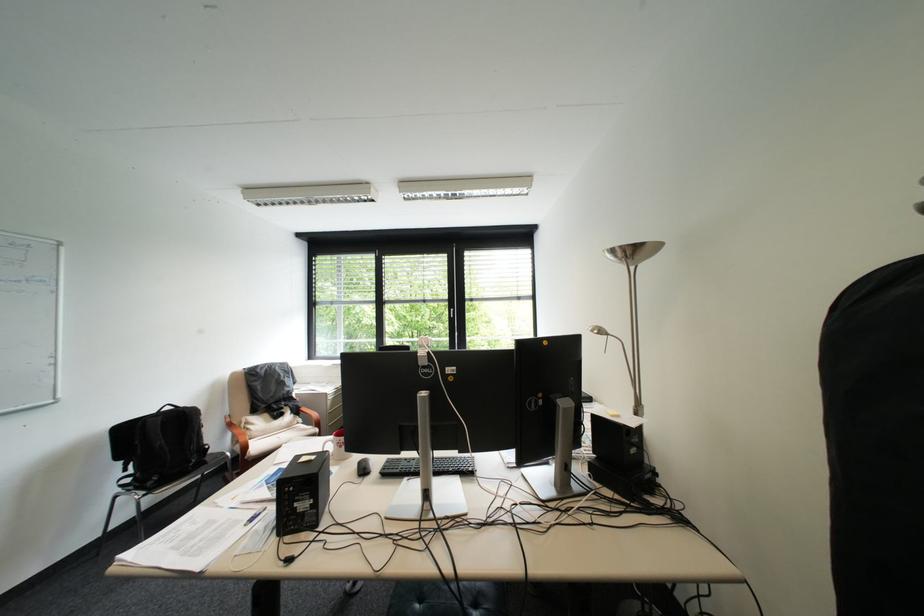
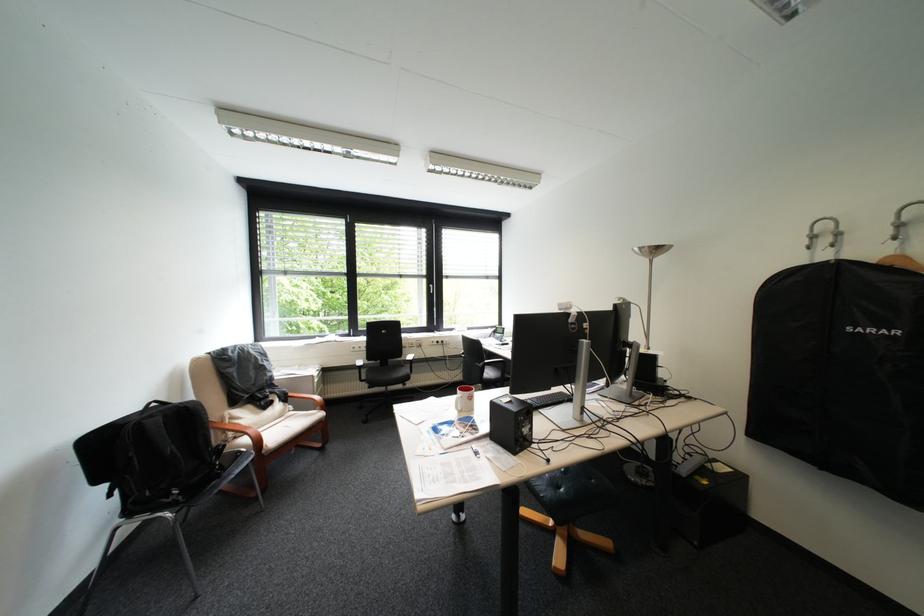
Where in the second image is the point corresponding to point (219, 446) from the first image?

(231, 445)